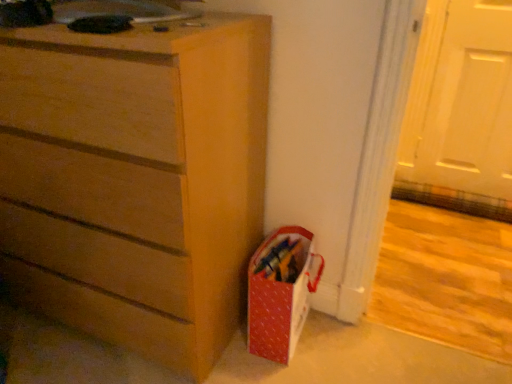
Question: From the image's perspective, is matte red gift bag at lower right above white matte door at upper right?

Choices:
 (A) yes
 (B) no

Answer: (B)

Question: From a real-world perspective, is matte red gift bag at lower right beneath white matte door at upper right?

Choices:
 (A) no
 (B) yes

Answer: (B)

Question: Are matte red gift bag at lower right and white matte door at upper right making contact?

Choices:
 (A) yes
 (B) no

Answer: (B)

Question: Considering the relative positions of matte red gift bag at lower right and white matte door at upper right in the image provided, is matte red gift bag at lower right behind white matte door at upper right?

Choices:
 (A) yes
 (B) no

Answer: (B)

Question: Is matte red gift bag at lower right not within white matte door at upper right?

Choices:
 (A) no
 (B) yes

Answer: (B)

Question: Can you confirm if matte red gift bag at lower right is shorter than white matte door at upper right?

Choices:
 (A) no
 (B) yes

Answer: (B)

Question: From the image's perspective, is matte wood chest of drawers at center on white matte door at upper right?

Choices:
 (A) yes
 (B) no

Answer: (B)

Question: Is matte wood chest of drawers at center smaller than white matte door at upper right?

Choices:
 (A) yes
 (B) no

Answer: (B)

Question: Can you confirm if matte wood chest of drawers at center is wider than white matte door at upper right?

Choices:
 (A) no
 (B) yes

Answer: (B)

Question: Considering the relative positions of matte wood chest of drawers at center and white matte door at upper right in the image provided, is matte wood chest of drawers at center to the left of white matte door at upper right from the viewer's perspective?

Choices:
 (A) no
 (B) yes

Answer: (B)

Question: Considering the relative positions of matte wood chest of drawers at center and white matte door at upper right in the image provided, is matte wood chest of drawers at center in front of white matte door at upper right?

Choices:
 (A) no
 (B) yes

Answer: (B)

Question: Is white matte door at upper right completely or partially inside matte wood chest of drawers at center?

Choices:
 (A) yes
 (B) no

Answer: (B)

Question: Is matte red gift bag at lower right in front of matte wood chest of drawers at center?

Choices:
 (A) no
 (B) yes

Answer: (A)